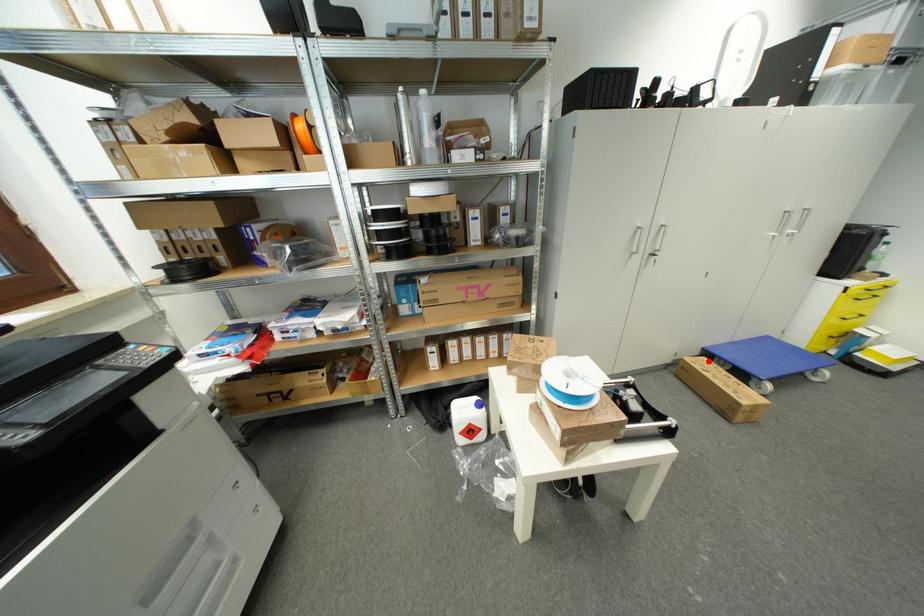
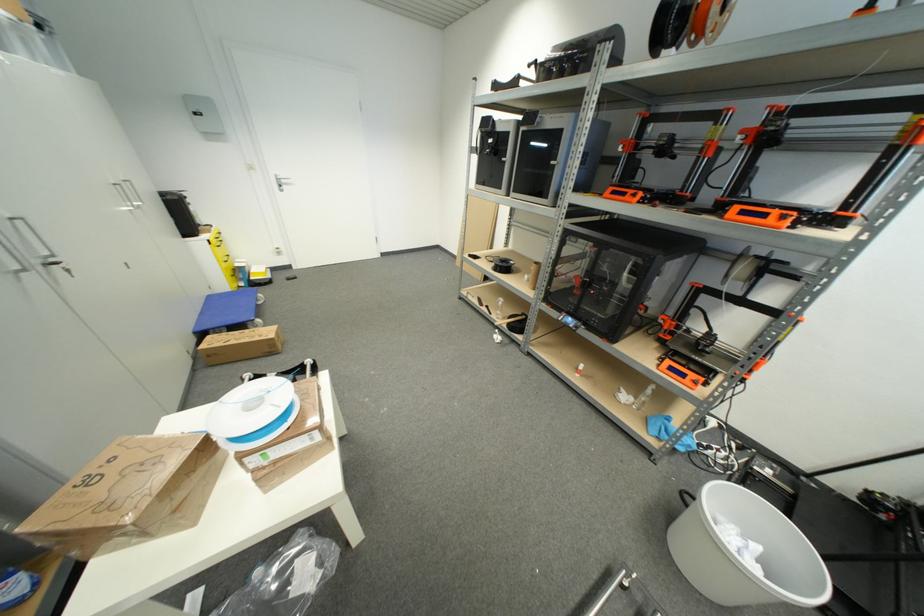
Find the pixel in the second image that matches the highlighted location in the first image.

(213, 339)